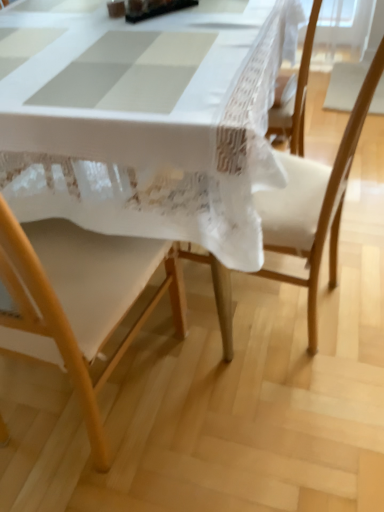
Question: Does white lace tablecloth at center have a lesser width compared to wooden chair at center, arranged as the 2th chair when viewed from the left?

Choices:
 (A) no
 (B) yes

Answer: (A)

Question: Can you confirm if white lace tablecloth at center is shorter than wooden chair at center, arranged as the first chair when viewed from the right?

Choices:
 (A) no
 (B) yes

Answer: (B)

Question: Can you confirm if white lace tablecloth at center is taller than wooden chair at center, arranged as the first chair when viewed from the right?

Choices:
 (A) yes
 (B) no

Answer: (B)

Question: Considering the relative sizes of white lace tablecloth at center and wooden chair at center, arranged as the first chair when viewed from the right, in the image provided, is white lace tablecloth at center smaller than wooden chair at center, arranged as the first chair when viewed from the right,?

Choices:
 (A) yes
 (B) no

Answer: (B)

Question: Considering the relative positions of white lace tablecloth at center and wooden chair at center, arranged as the 2th chair when viewed from the left, in the image provided, is white lace tablecloth at center to the left of wooden chair at center, arranged as the 2th chair when viewed from the left, from the viewer's perspective?

Choices:
 (A) yes
 (B) no

Answer: (A)

Question: In the image, is wooden chair at lower left, acting as the 2th chair starting from the right, on the left side or the right side of wooden chair at center, arranged as the first chair when viewed from the right?

Choices:
 (A) right
 (B) left

Answer: (B)

Question: Based on their sizes in the image, would you say wooden chair at lower left, acting as the 2th chair starting from the right, is bigger or smaller than wooden chair at center, arranged as the first chair when viewed from the right?

Choices:
 (A) small
 (B) big

Answer: (A)

Question: Looking at their shapes, would you say wooden chair at lower left, acting as the 2th chair starting from the right, is wider or thinner than wooden chair at center, arranged as the first chair when viewed from the right?

Choices:
 (A) wide
 (B) thin

Answer: (B)

Question: Relative to wooden chair at center, arranged as the first chair when viewed from the right, is wooden chair at lower left, the 1th chair in the left-to-right sequence, in front or behind?

Choices:
 (A) front
 (B) behind

Answer: (A)

Question: From a real-world perspective, is wooden chair at center, arranged as the 2th chair when viewed from the left, above or below wooden chair at lower left, acting as the 2th chair starting from the right?

Choices:
 (A) below
 (B) above

Answer: (A)

Question: From the image's perspective, is wooden chair at center, arranged as the 2th chair when viewed from the left, above or below wooden chair at lower left, acting as the 2th chair starting from the right?

Choices:
 (A) below
 (B) above

Answer: (B)

Question: Would you say wooden chair at center, arranged as the first chair when viewed from the right, is inside or outside wooden chair at lower left, acting as the 2th chair starting from the right?

Choices:
 (A) inside
 (B) outside

Answer: (B)

Question: In the image, is wooden chair at center, arranged as the 2th chair when viewed from the left, on the left side or the right side of wooden chair at lower left, acting as the 2th chair starting from the right?

Choices:
 (A) left
 (B) right

Answer: (B)

Question: From a real-world perspective, is white lace tablecloth at center positioned above or below wooden chair at lower left, the 1th chair in the left-to-right sequence?

Choices:
 (A) above
 (B) below

Answer: (B)

Question: Looking at the image, does white lace tablecloth at center seem bigger or smaller compared to wooden chair at lower left, acting as the 2th chair starting from the right?

Choices:
 (A) small
 (B) big

Answer: (B)